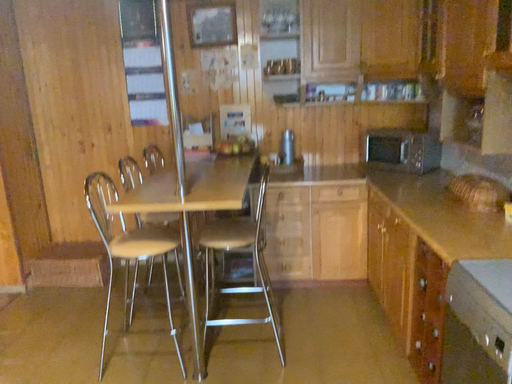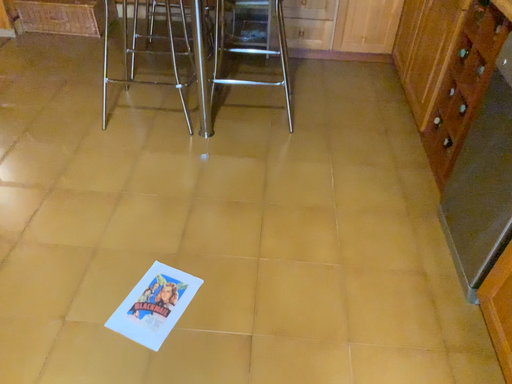
Question: Which way did the camera rotate in the video?

Choices:
 (A) rotated upward
 (B) rotated downward

Answer: (B)